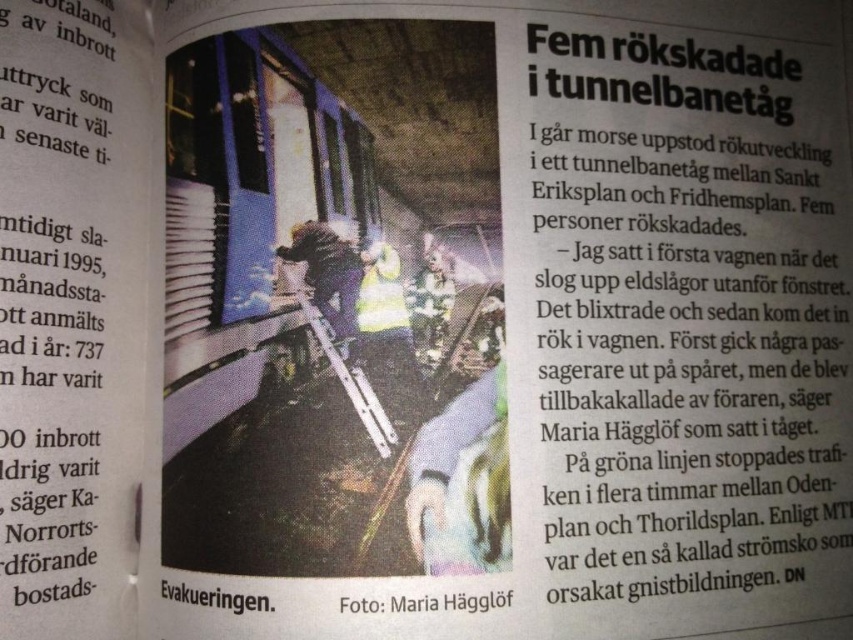
What are the coordinates of the white paper at upper center in the newspaper clipping?

The white paper at upper center is located at point (692, 314).

You are looking at the newspaper clipping and want to determine which object is closer to you. Which is closer between the white paper at upper center and the blacktextured fabricphoto at center?

The white paper at upper center is closer to you because it is positioned further to the viewer than the blacktextured fabricphoto at center.